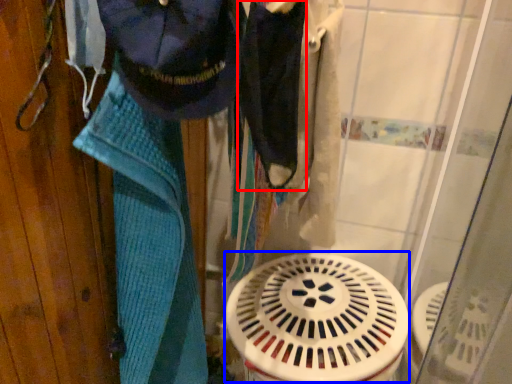
Question: Which of the following is the closest to the observer, clothing (highlighted by a red box) or water heater (highlighted by a blue box)?

Choices:
 (A) clothing
 (B) water heater

Answer: (A)